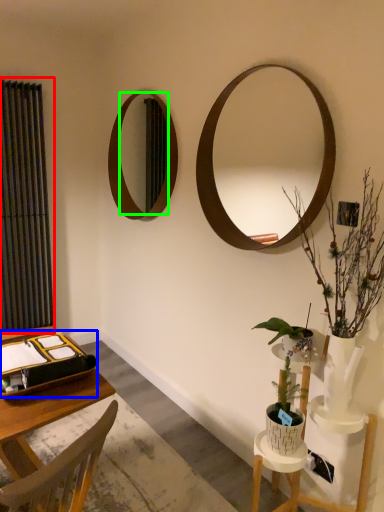
Question: Considering the real-world distances, which object is closest to curtain (highlighted by a red box)? binder (highlighted by a blue box) or mirror (highlighted by a green box).

Choices:
 (A) binder
 (B) mirror

Answer: (B)